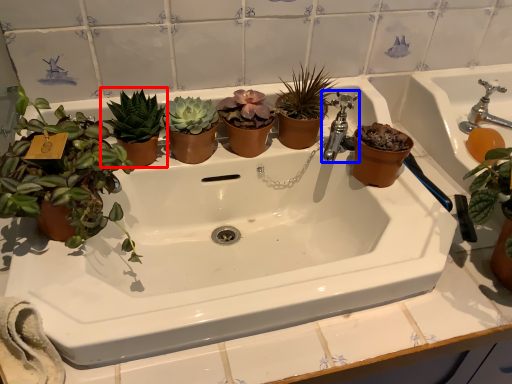
Question: Among these objects, which one is farthest to the camera, houseplant (highlighted by a red box) or tap (highlighted by a blue box)?

Choices:
 (A) houseplant
 (B) tap

Answer: (B)